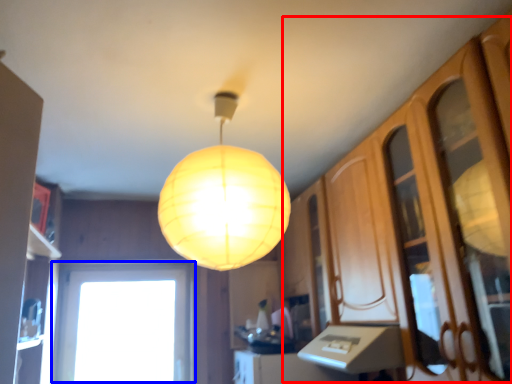
Question: Which object appears farthest to the camera in this image, dresser (highlighted by a red box) or window (highlighted by a blue box)?

Choices:
 (A) dresser
 (B) window

Answer: (B)